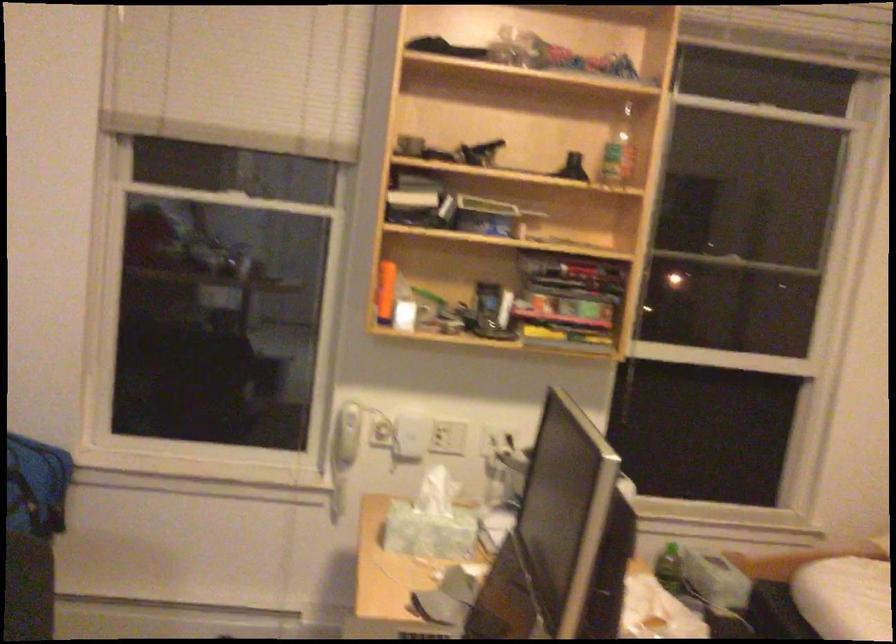
How did the camera likely rotate?

The rotation direction of the camera is right-down.